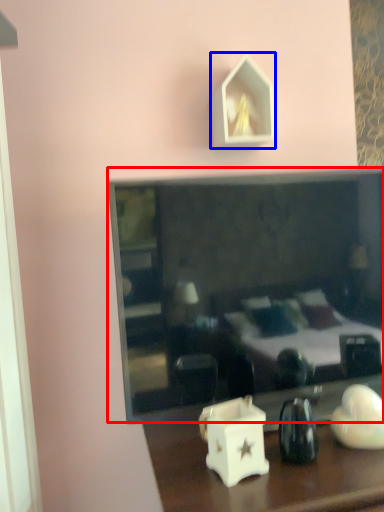
Question: Which object is further to the camera taking this photo, mirror (highlighted by a red box) or picture frame (highlighted by a blue box)?

Choices:
 (A) mirror
 (B) picture frame

Answer: (B)